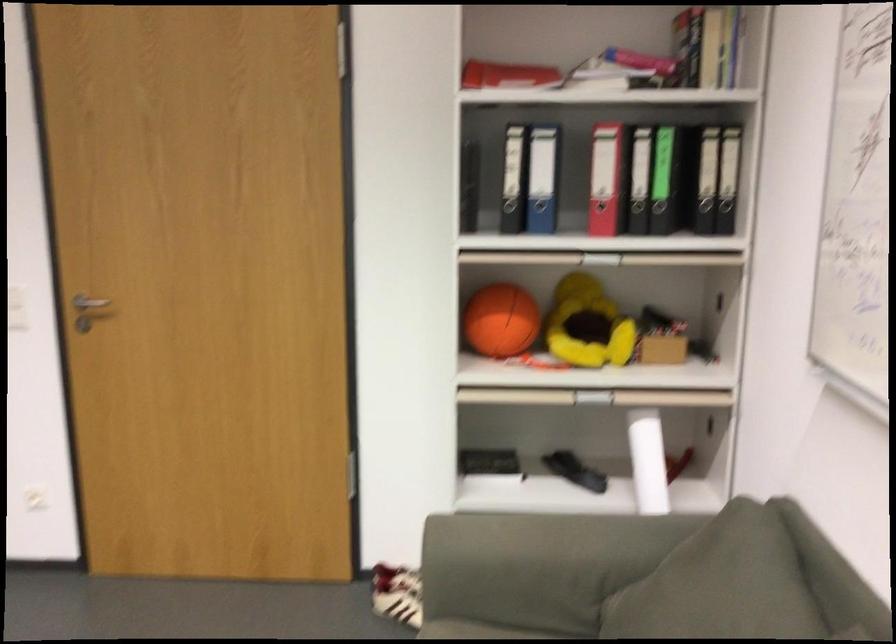
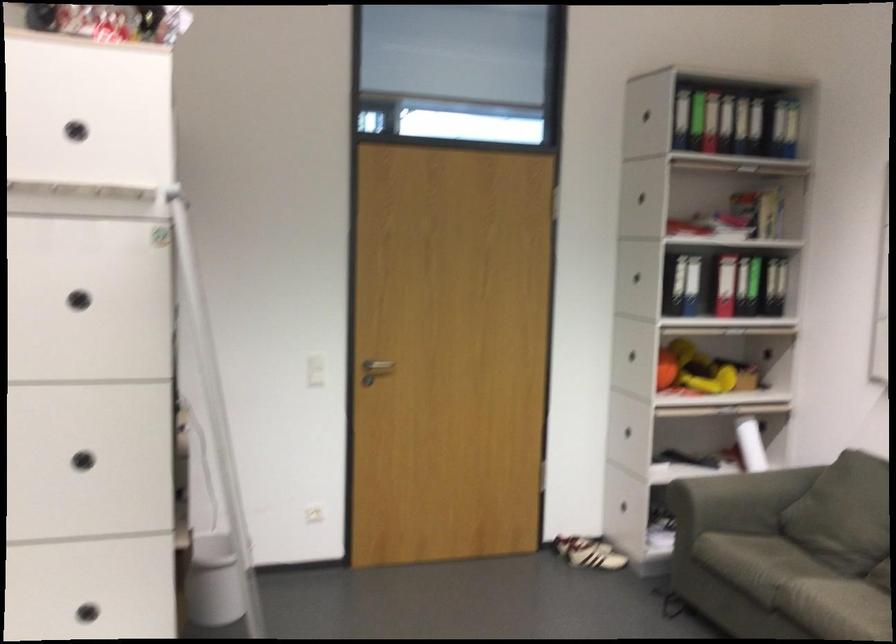
Question: I am providing you with two images of the same scene from different viewpoints. Which of the following objects are not visible in image2?

Choices:
 (A) red binder hole
 (B) red binder
 (C) dispenser drip tray
 (D) sofa sitting surface

Answer: (A)